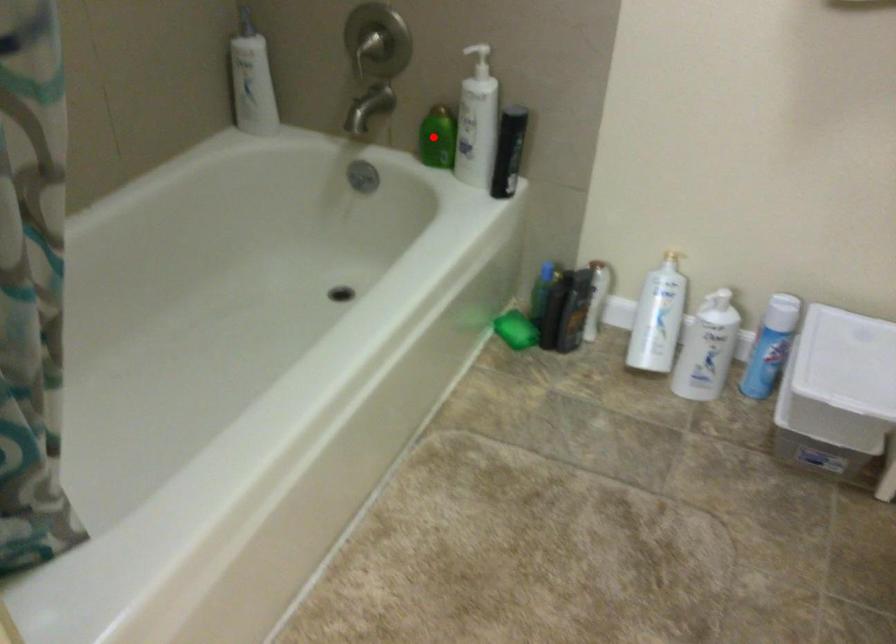
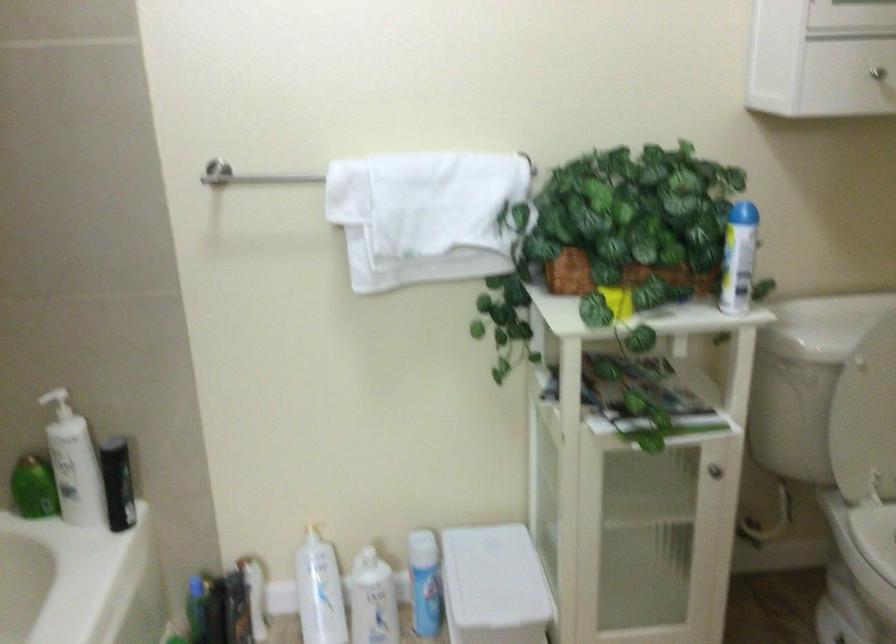
Locate, in the second image, the point that corresponds to the highlighted location in the first image.

(33, 488)